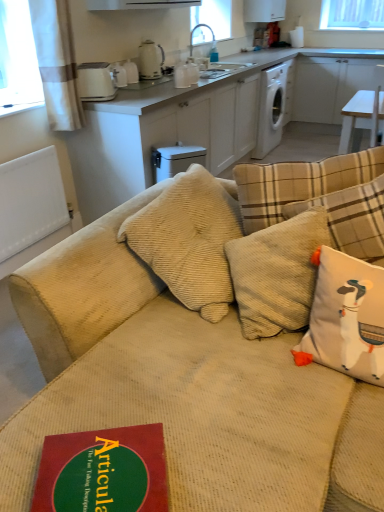
Question: Can you confirm if white glossy exhaust hood at upper center is taller than matte white cabinet at upper center?

Choices:
 (A) no
 (B) yes

Answer: (A)

Question: Is white glossy exhaust hood at upper center at the left side of matte white cabinet at upper center?

Choices:
 (A) no
 (B) yes

Answer: (B)

Question: Is white glossy exhaust hood at upper center not inside matte white cabinet at upper center?

Choices:
 (A) no
 (B) yes

Answer: (B)

Question: From the image's perspective, would you say white glossy exhaust hood at upper center is positioned over matte white cabinet at upper center?

Choices:
 (A) yes
 (B) no

Answer: (A)

Question: Can you confirm if white glossy exhaust hood at upper center is positioned to the right of matte white cabinet at upper center?

Choices:
 (A) yes
 (B) no

Answer: (B)

Question: Could matte white cabinet at upper center be considered to be inside white glossy exhaust hood at upper center?

Choices:
 (A) no
 (B) yes

Answer: (A)

Question: Is white corduroy pillow at right far from beige corduroy couch at center?

Choices:
 (A) no
 (B) yes

Answer: (A)

Question: Is white corduroy pillow at right further to the viewer compared to beige corduroy couch at center?

Choices:
 (A) yes
 (B) no

Answer: (A)

Question: Is white corduroy pillow at right at the right side of beige corduroy couch at center?

Choices:
 (A) yes
 (B) no

Answer: (A)

Question: Is white corduroy pillow at right turned away from beige corduroy couch at center?

Choices:
 (A) no
 (B) yes

Answer: (B)

Question: Would you say white corduroy pillow at right is outside beige corduroy couch at center?

Choices:
 (A) yes
 (B) no

Answer: (B)

Question: Can you confirm if white corduroy pillow at right is thinner than beige corduroy couch at center?

Choices:
 (A) yes
 (B) no

Answer: (A)

Question: Does white ceramic kettle at upper center, positioned as the third appliance in right-to-left order, have a lesser width compared to beige corduroy couch at center?

Choices:
 (A) no
 (B) yes

Answer: (B)